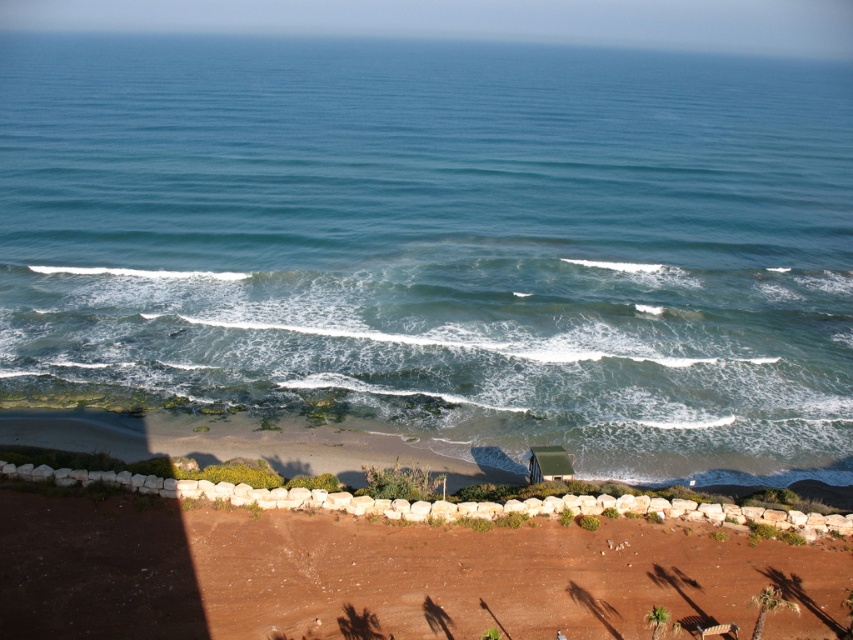
Does blue water at center have a larger size compared to brown sandy soil at lower center?

Indeed, blue water at center has a larger size compared to brown sandy soil at lower center.

Which of these two, blue water at center or brown sandy soil at lower center, stands taller?

blue water at center is taller.

Who is more distant from viewer, (x=724, y=67) or (x=450, y=540)?

The point (x=724, y=67) is more distant.

This screenshot has height=640, width=853. I want to click on blue water at center, so click(440, 243).